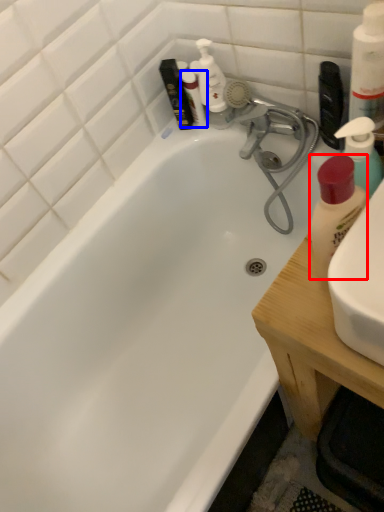
Question: Which object appears farthest to the camera in this image, cleaning product (highlighted by a red box) or toiletry (highlighted by a blue box)?

Choices:
 (A) cleaning product
 (B) toiletry

Answer: (B)